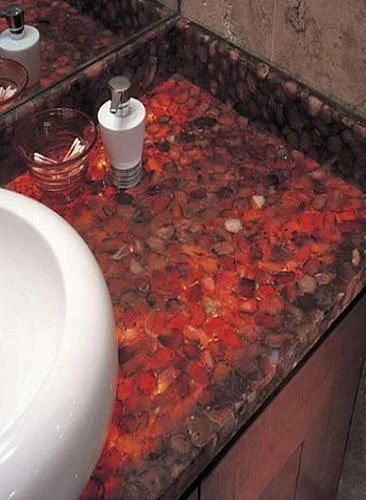
Where is `mirror`? The height and width of the screenshot is (500, 366). mirror is located at coordinates (58, 24).